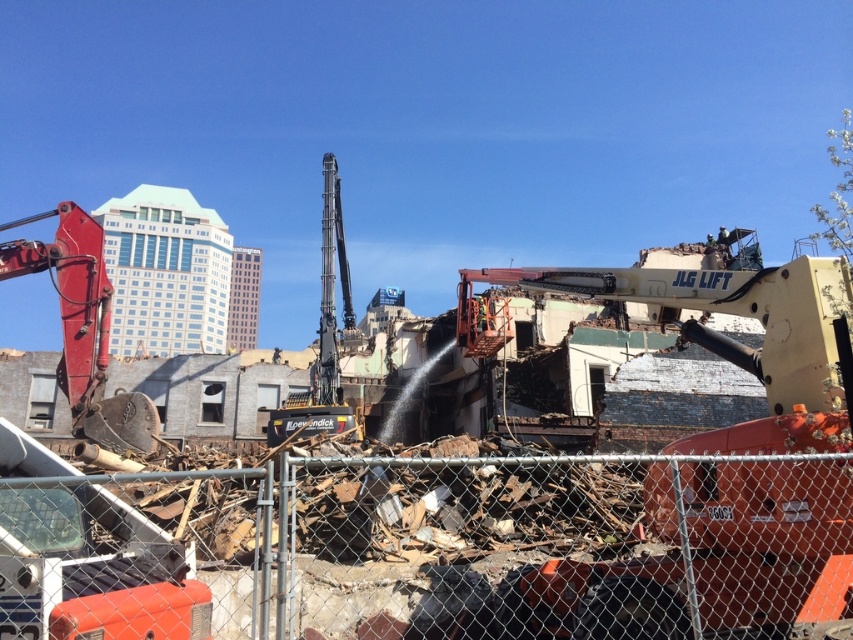
Is yellow metallic excavator at center below matte red excavator at left?

Yes, yellow metallic excavator at center is below matte red excavator at left.

Does yellow metallic excavator at center have a larger size compared to matte red excavator at left?

Actually, yellow metallic excavator at center might be smaller than matte red excavator at left.

Who is more distant from viewer, (809, 573) or (113, 406)?

The point (113, 406) is behind.

Image resolution: width=853 pixels, height=640 pixels. I want to click on yellow metallic excavator at center, so click(x=706, y=556).

Can you confirm if yellow metallic excavator at center is bigger than black metallic excavator at center?

No, yellow metallic excavator at center is not bigger than black metallic excavator at center.

Measure the distance between point (724, 508) and camera.

The distance of point (724, 508) from camera is 9.00 meters.

Who is more distant from viewer, (x=572, y=630) or (x=334, y=186)?

The point (x=334, y=186) is behind.

I want to click on yellow metallic excavator at center, so click(x=706, y=556).

Can you confirm if metal chain-link fence at center is positioned to the right of black metallic excavator at center?

Correct, you'll find metal chain-link fence at center to the right of black metallic excavator at center.

Who is more forward, [787,577] or [280,417]?

Point [787,577] is in front.

The image size is (853, 640). Identify the location of metal chain-link fence at center. (426, 548).